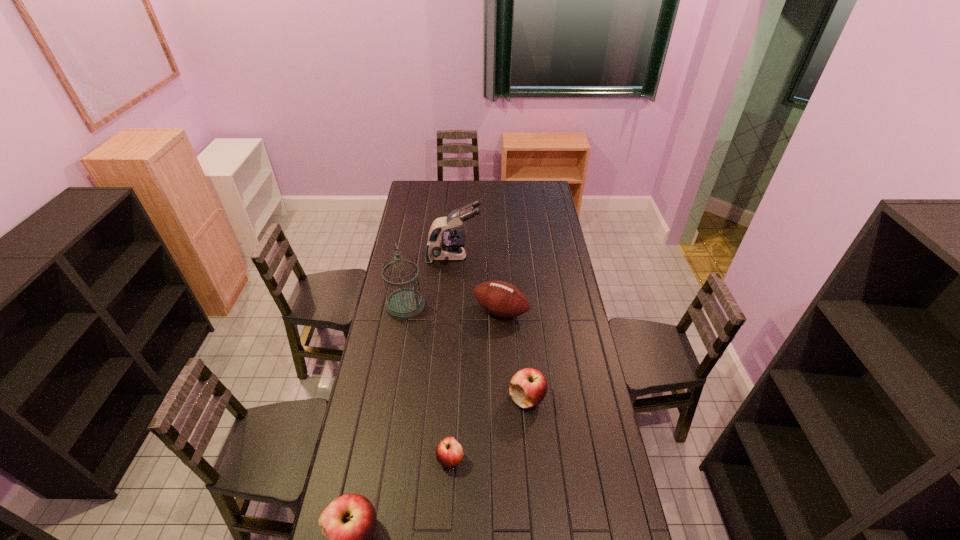
What are the coordinates of `vacant space that satisfies the following two spatial constraints: 1. through the eyepieces of the shortest apple; 2. on the right side of the farthest object` in the screenshot? It's located at (440, 459).